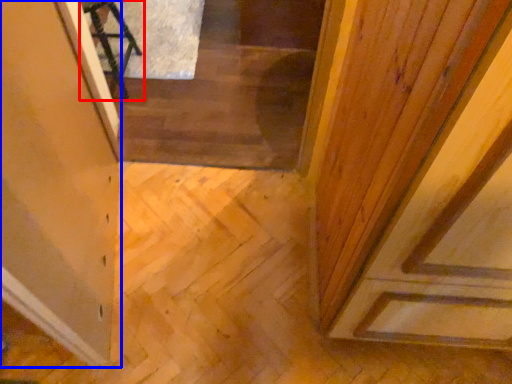
Question: Which object is further to the camera taking this photo, furniture (highlighted by a red box) or glass door (highlighted by a blue box)?

Choices:
 (A) furniture
 (B) glass door

Answer: (A)